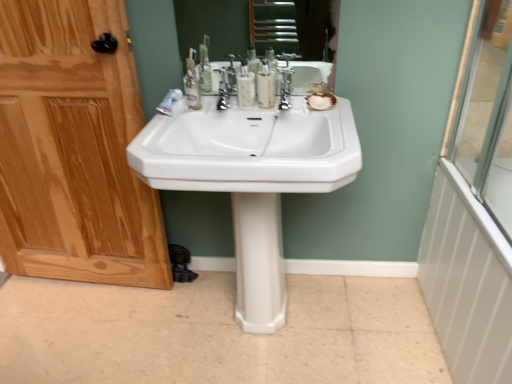
This screenshot has width=512, height=384. Find the location of `vacant space that's between wooden door at left and white glossy pedestal at center`. vacant space that's between wooden door at left and white glossy pedestal at center is located at coordinates (170, 304).